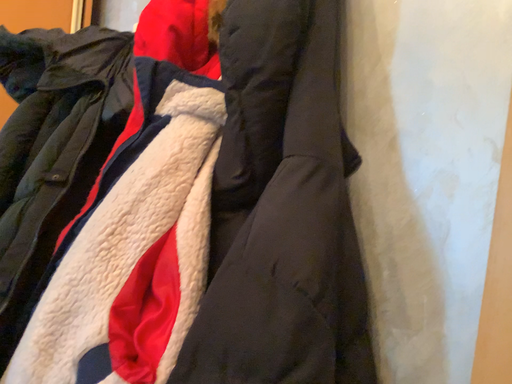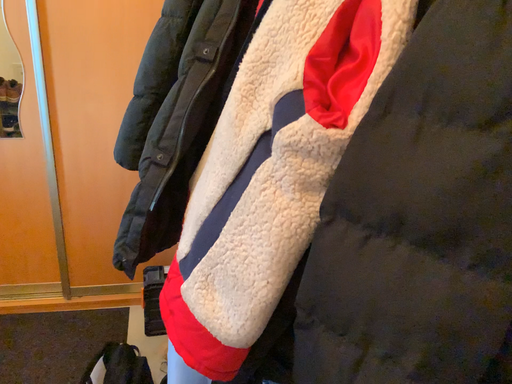
Question: How did the camera likely rotate when shooting the video?

Choices:
 (A) rotated downward
 (B) rotated upward

Answer: (A)